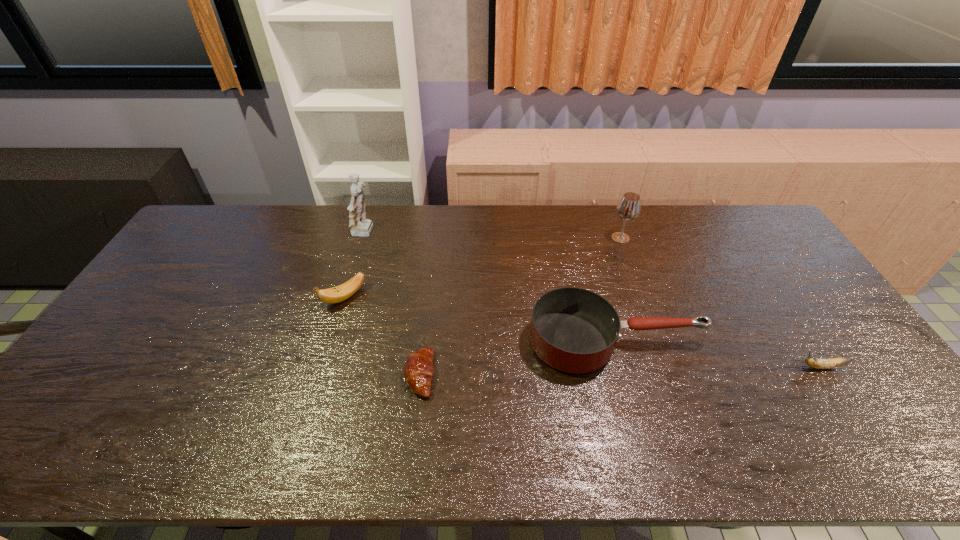
Identify the location of vacant space that's between the farther banana and the wineglass. (483, 267).

You are a GUI agent. You are given a task and a screenshot of the screen. Output one action in this format:
    pyautogui.click(x=<x>, y=<y>)
    Task: Click on the vacant point located between the crescent roll and the pan
    This screenshot has width=960, height=540.
    Given the screenshot: What is the action you would take?
    pyautogui.click(x=517, y=358)

Where is `free point between the tallest object and the fourth object from right to left`? free point between the tallest object and the fourth object from right to left is located at coordinates (393, 304).

Find the location of a particular element. unoccupied area between the wineglass and the rightmost object is located at coordinates (721, 302).

Find the location of `empty location between the farther banana and the pan`. empty location between the farther banana and the pan is located at coordinates coord(480,319).

Identify which object is the second closest to the rightmost object. Please provide its 2D coordinates. Your answer should be formatted as a tuple, i.e. [(x, y)], where the tuple contains the x and y coordinates of a point satisfying the conditions above.

[(629, 207)]

I want to click on object that is the fourth closest to the fourth object from right to left, so click(629, 207).

Locate an element on the screen. This screenshot has height=540, width=960. free space that satisfies the following two spatial constraints: 1. on the front-facing side of the fifth shortest object; 2. on the right side of the tallest object is located at coordinates (364, 238).

The image size is (960, 540). Identify the location of free space that satisfies the following two spatial constraints: 1. on the front-facing side of the second tallest object; 2. on the left side of the figurine. (364, 238).

Locate an element on the screen. This screenshot has width=960, height=540. free space that satisfies the following two spatial constraints: 1. on the front-facing side of the shortest object; 2. on the left side of the figurine is located at coordinates (323, 375).